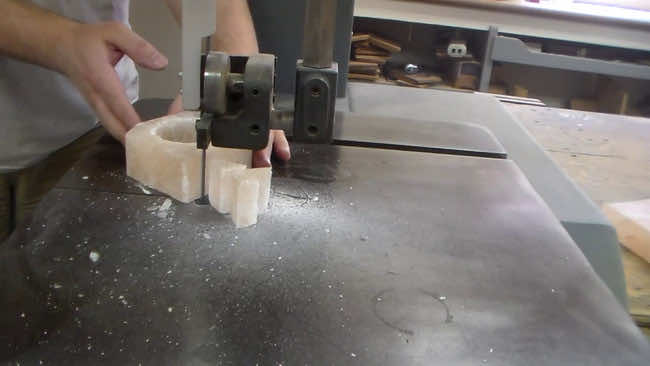
Image resolution: width=650 pixels, height=366 pixels. Identify the location of piles of dust. (281, 208), (162, 215), (93, 258).